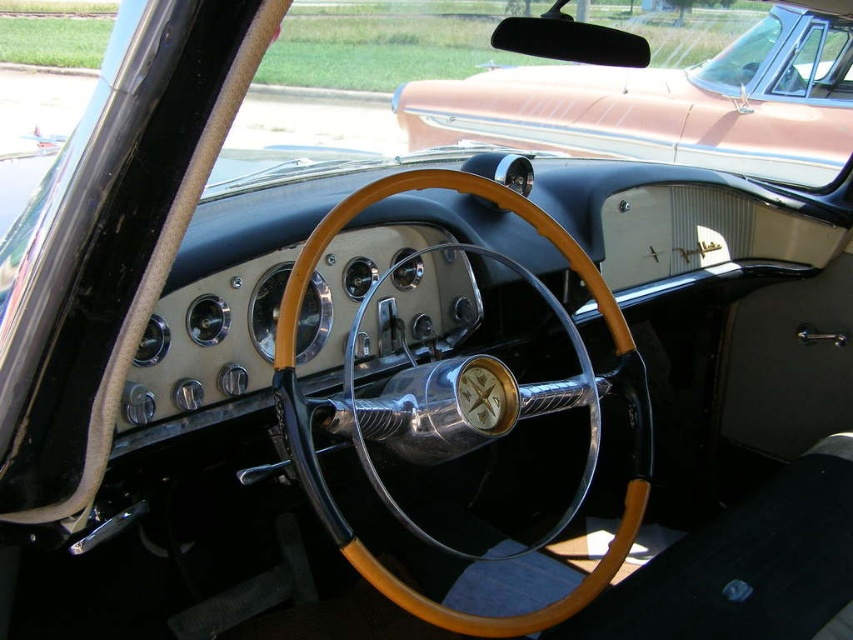
You are sitting in the driver seat of the vintage car. There is a point at coordinates point (299, 266) that you want to reach with your hand. Can you estimate whether this point is within your comfortable reach?

The point (299, 266) is 1.17 meters away from the viewer, which is within a typical comfortable reaching distance for most adults, so yes, it should be reachable.